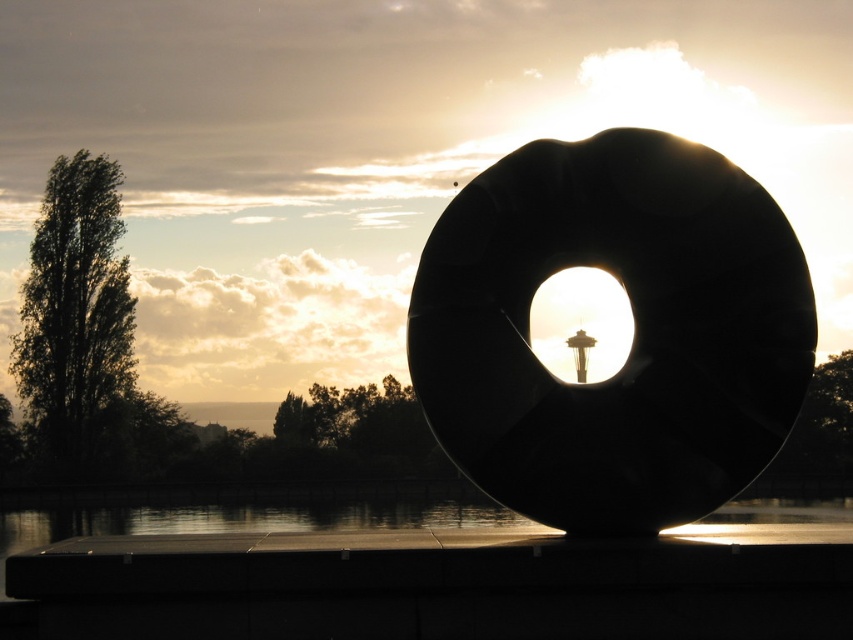
Does black matte ring at center appear on the left side of transparent glass water at bottom?

In fact, black matte ring at center is to the right of transparent glass water at bottom.

Is black matte ring at center positioned before transparent glass water at bottom?

No, it is behind transparent glass water at bottom.

The width and height of the screenshot is (853, 640). I want to click on black matte ring at center, so click(x=633, y=332).